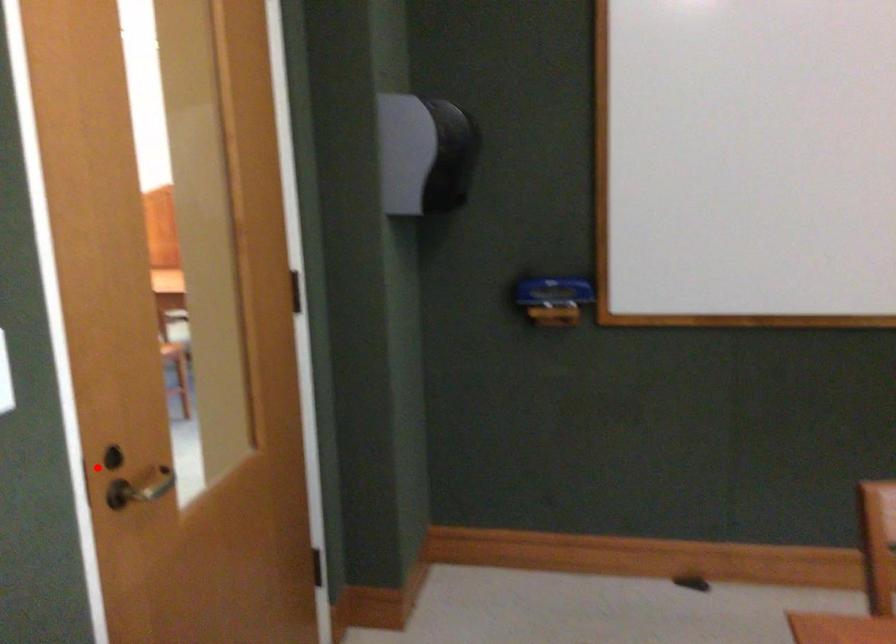
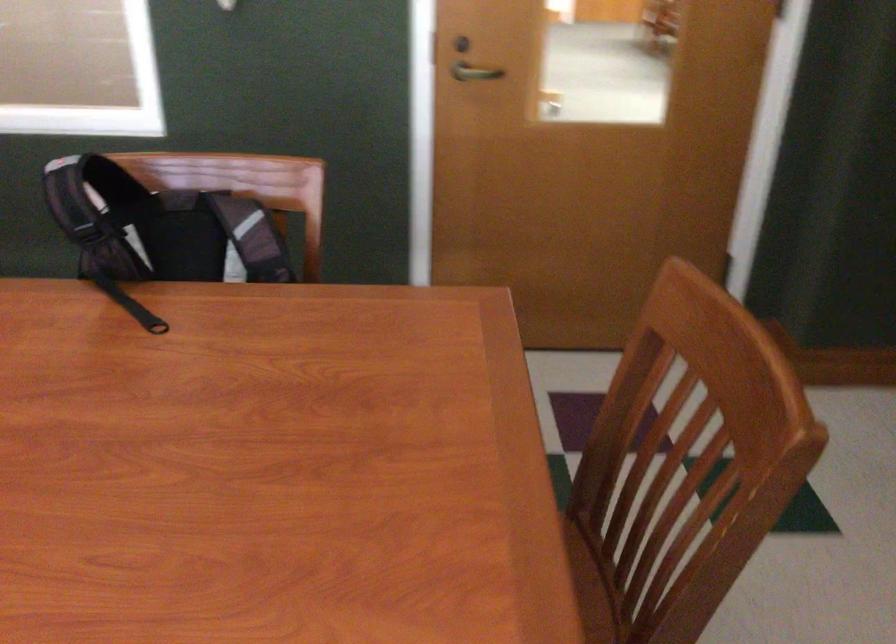
In the second image, find the point that corresponds to the highlighted location in the first image.

(460, 44)